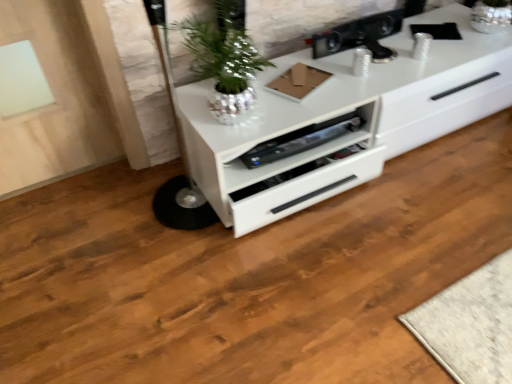
Question: Looking at their shapes, would you say metallic black speaker at upper center, the second appliance when ordered from bottom to top, is wider or thinner than satin black speaker at center, which ranks as the 2th appliance in top-to-bottom order?

Choices:
 (A) thin
 (B) wide

Answer: (A)

Question: Looking at the image, does metallic black speaker at upper center, arranged as the first appliance when viewed from the top, seem bigger or smaller compared to satin black speaker at center, which ranks as the 2th appliance in top-to-bottom order?

Choices:
 (A) big
 (B) small

Answer: (A)

Question: Estimate the real-world distances between objects in this image. Which object is farther from the metallic black speaker at upper center, arranged as the first appliance when viewed from the top?

Choices:
 (A) shiny metallic plant at center
 (B) white glossy chest of drawers at center
 (C) satin black speaker at center, which ranks as the 2th appliance in top-to-bottom order

Answer: (A)

Question: Which object is positioned farthest from the metallic black speaker at upper center, the second appliance when ordered from bottom to top?

Choices:
 (A) satin black speaker at center, which ranks as the 2th appliance in top-to-bottom order
 (B) shiny metallic plant at center
 (C) white glossy chest of drawers at center

Answer: (B)